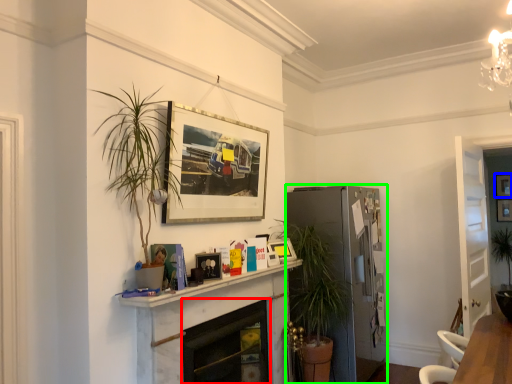
Question: Which is nearer to the fireplace (highlighted by a red box)? picture frame (highlighted by a blue box) or fridge (highlighted by a green box).

Choices:
 (A) picture frame
 (B) fridge

Answer: (B)